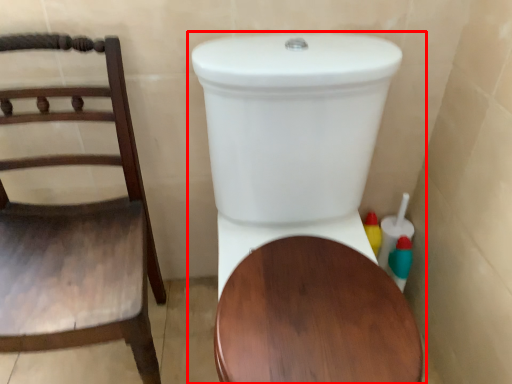
Question: From the image's perspective, where is toilet (annotated by the red box) located in relation to chair in the image?

Choices:
 (A) below
 (B) above

Answer: (A)